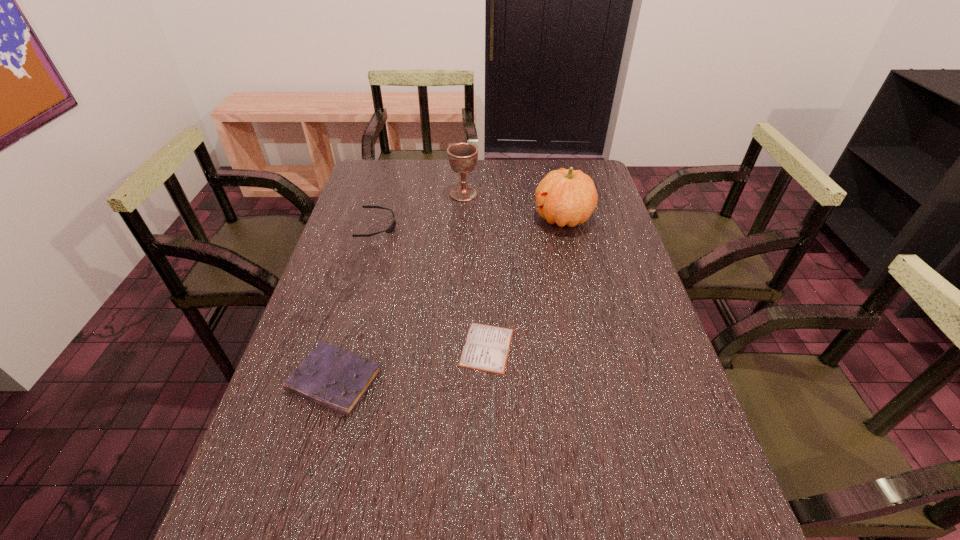
The width and height of the screenshot is (960, 540). I want to click on unoccupied area between the fourth shortest object and the pumpkin, so click(x=514, y=206).

The image size is (960, 540). I want to click on free space between the farthest object and the taller diary, so click(x=399, y=287).

Where is `object that stands as the closest to the farthest object`? Image resolution: width=960 pixels, height=540 pixels. object that stands as the closest to the farthest object is located at coordinates (390, 229).

At what (x,y) coordinates should I click in order to perform the action: click on object identified as the second closest to the left diary. Please return your answer as a coordinate pair (x, y). This screenshot has height=540, width=960. Looking at the image, I should click on (390, 229).

Locate an element on the screen. vacant point that satisfies the following two spatial constraints: 1. on the front side of the right diary; 2. on the right side of the fourth shortest object is located at coordinates click(456, 347).

Image resolution: width=960 pixels, height=540 pixels. What are the coordinates of `free location that satisfies the following two spatial constraints: 1. on the front-facing side of the sunglasses; 2. on the right side of the taller diary` in the screenshot? It's located at (333, 381).

Identify the location of vacant space that satisfies the following two spatial constraints: 1. on the front-facing side of the sunglasses; 2. on the right side of the left diary. The image size is (960, 540). (333, 381).

Locate an element on the screen. This screenshot has height=540, width=960. vacant space that satisfies the following two spatial constraints: 1. on the back side of the shortest object; 2. on the front-facing side of the sunglasses is located at coordinates (485, 226).